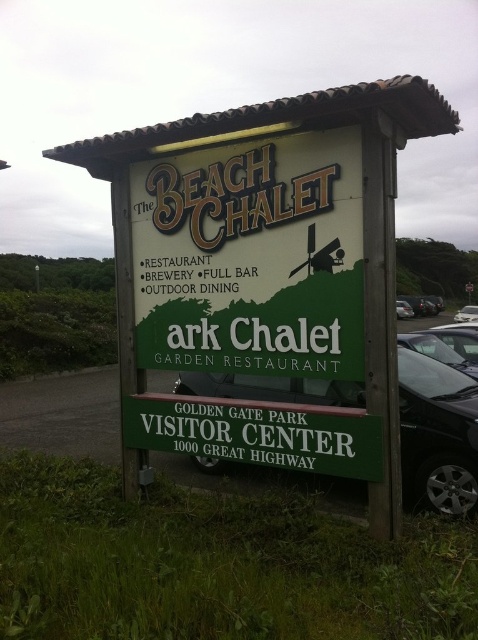
You are designing a new sign for The Beach Chalet and need to ensure it matches the existing style. The current sign has two versions displayed. Which of the two signs, the green matte signboard at center or the green wooden signboard at center, is narrower?

The green matte signboard at center is narrower than the green wooden signboard at center.

You are a tourist trying to take a photo of the green wooden signboard at center. There is a black glossy car at lower right parked nearby. Will the car block your view of the signboard?

The green wooden signboard at center has a larger size compared to black glossy car at lower right, so the car is smaller and less likely to block the view of the signboard if positioned appropriately.

You are a photographer trying to capture the green wooden signboard at center and the black glossy car at lower right in the same frame. Based on the scene, which object is taller?

The green wooden signboard at center is much taller than the black glossy car at lower right.